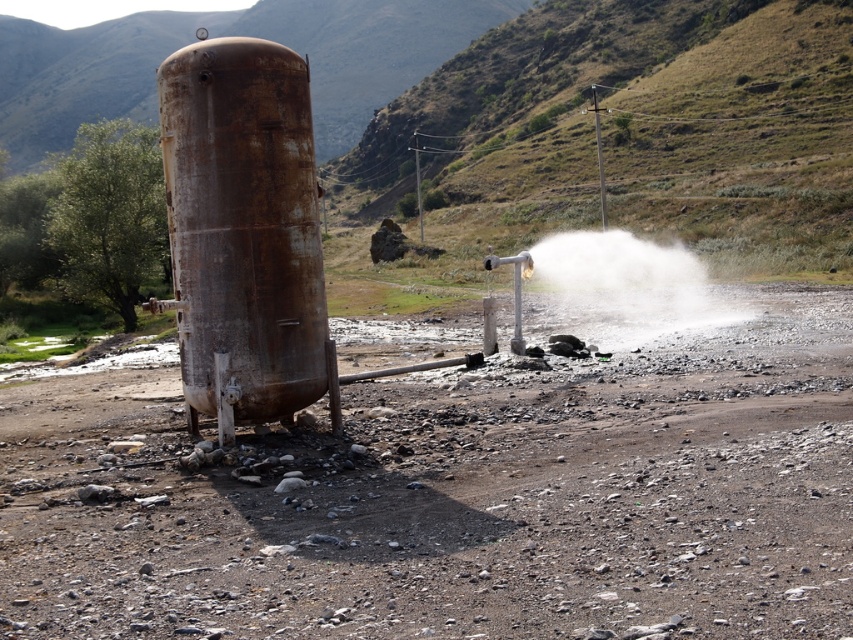
Question: Which object is the farthest from the rusty metal water tower at center?

Choices:
 (A) rusty metallic tank at center-left
 (B) white powdery steam at center

Answer: (B)

Question: Is rusty metallic tank at center-left above white powdery steam at center?

Choices:
 (A) yes
 (B) no

Answer: (B)

Question: Does rusty metal water tower at center lie behind white powdery steam at center?

Choices:
 (A) no
 (B) yes

Answer: (A)

Question: Which point appears closest to the camera in this image?

Choices:
 (A) (281, 360)
 (B) (27, 436)
 (C) (692, 307)

Answer: (A)

Question: Is rusty metallic tank at center-left below rusty metal water tower at center?

Choices:
 (A) yes
 (B) no

Answer: (A)

Question: Which is farther from the white powdery steam at center?

Choices:
 (A) rusty metallic tank at center-left
 (B) rusty metal water tower at center

Answer: (B)